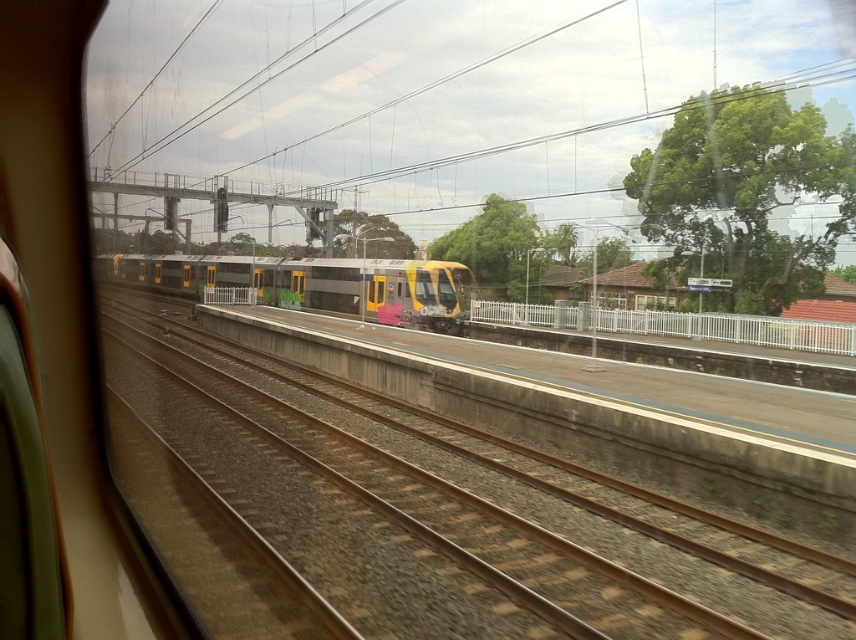
Looking at this image, can you confirm if brown gravel track at center is positioned below metallic gray train at center?

Yes.

Who is lower down, brown gravel track at center or metallic gray train at center?

brown gravel track at center is below.

Does point (521, 506) come in front of point (343, 273)?

Yes.

Image resolution: width=856 pixels, height=640 pixels. I want to click on brown gravel track at center, so click(x=468, y=513).

Is point (364, 284) farther from viewer compared to point (825, 342)?

Yes, point (364, 284) is behind point (825, 342).

Consider the image. Can you confirm if metallic gray train at center is smaller than white metal fence at right?

Incorrect, metallic gray train at center is not smaller in size than white metal fence at right.

Measure the distance between metallic gray train at center and camera.

3.42 meters

Where is `metallic gray train at center`? The height and width of the screenshot is (640, 856). metallic gray train at center is located at coordinates (316, 284).

Is point (568, 531) more distant than point (837, 349)?

No, it is in front of (837, 349).

Which is behind, point (599, 493) or point (690, 316)?

The point (690, 316) is behind.

Locate an element on the screen. brown gravel track at center is located at coordinates (468, 513).